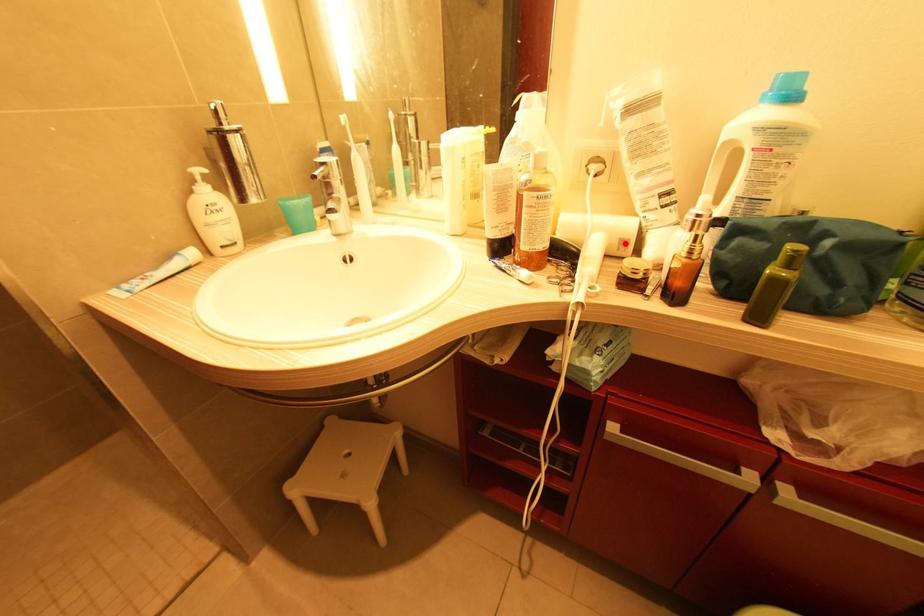
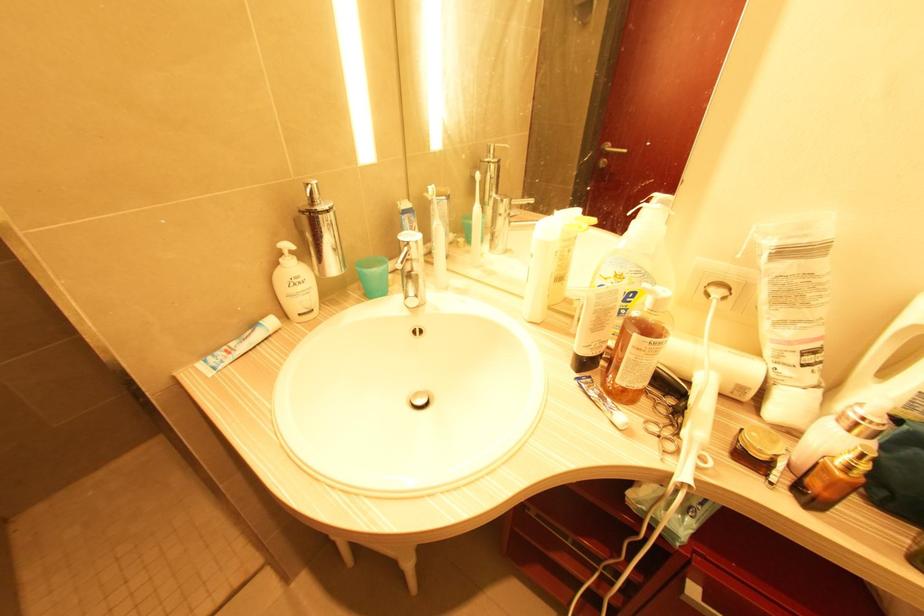
Where in the second image is the point corresponding to the highlighted location from the first image?

(743, 390)